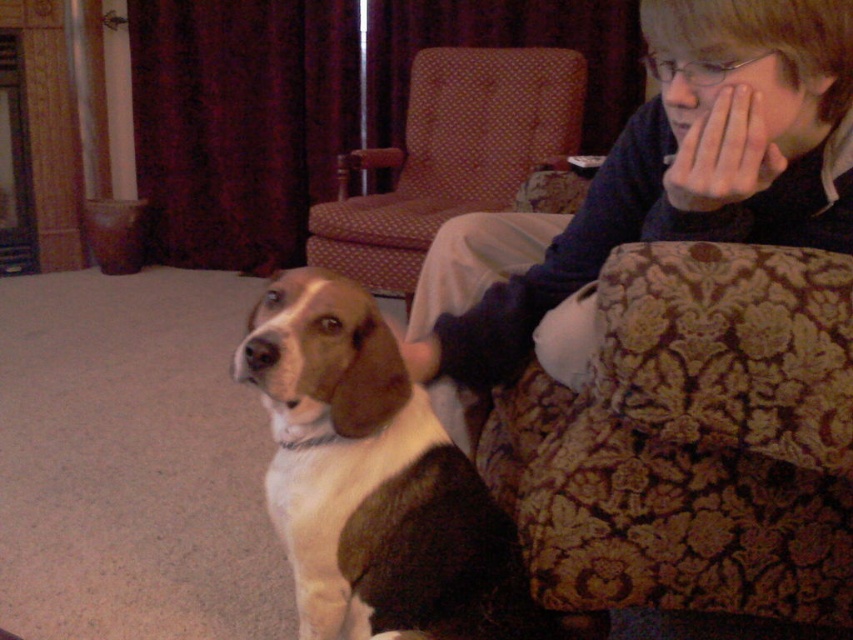
You are organizing a photo shoot and need to ensure the matte blue sweater at upper right is visible in the final shot. Given its current position relative to the patterned fabric armchair at center, what adjustment should you make to the camera angle?

The matte blue sweater at upper right is positioned under the patterned fabric armchair at center, so to ensure visibility, you should lower the camera angle to capture below the armchair.